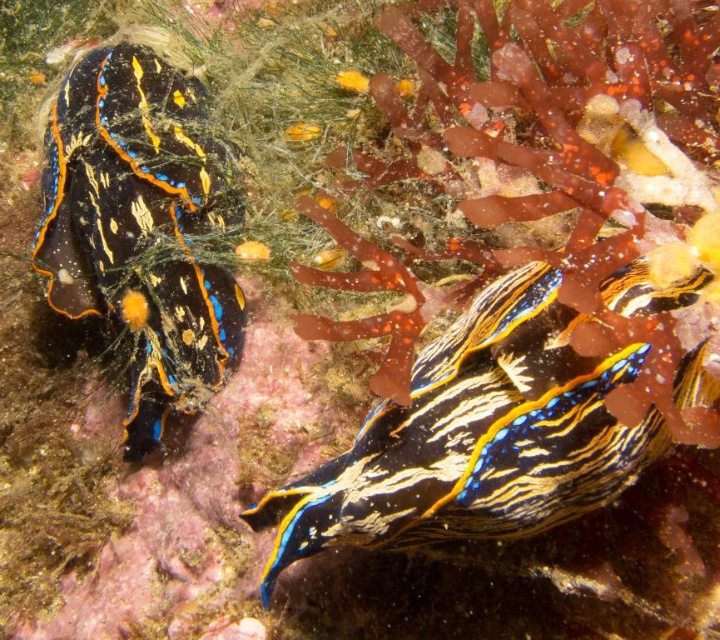
Can you confirm if shiny blue and yellow striped sea slug at center is positioned to the right of shiny black and blue shell at left?

Correct, you'll find shiny blue and yellow striped sea slug at center to the right of shiny black and blue shell at left.

Is the position of shiny blue and yellow striped sea slug at center more distant than that of shiny black and blue shell at left?

No.

What do you see at coordinates (474, 436) in the screenshot? I see `shiny blue and yellow striped sea slug at center` at bounding box center [474, 436].

The width and height of the screenshot is (720, 640). In order to click on shiny blue and yellow striped sea slug at center in this screenshot , I will do `click(474, 436)`.